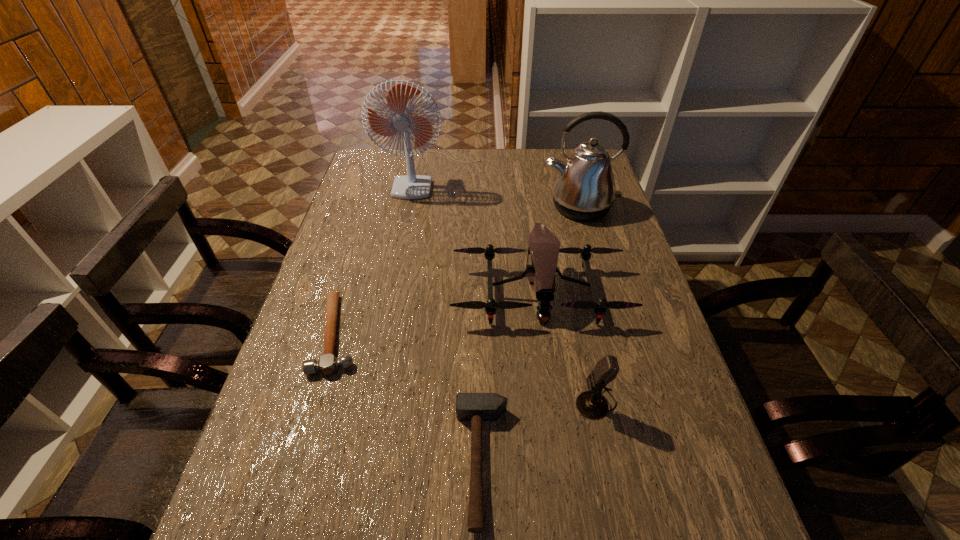
This screenshot has height=540, width=960. Identify the location of fan. (401, 119).

Where is `the second tallest object`? The height and width of the screenshot is (540, 960). the second tallest object is located at coordinates (584, 189).

You are a GUI agent. You are given a task and a screenshot of the screen. Output one action in this format:
    pyautogui.click(x=<x>, y=<y>)
    Task: Click on the drone
    
    Given the screenshot: What is the action you would take?
    pyautogui.click(x=544, y=247)

The height and width of the screenshot is (540, 960). What are the coordinates of `microphone` in the screenshot? It's located at (591, 404).

You are a GUI agent. You are given a task and a screenshot of the screen. Output one action in this format:
    pyautogui.click(x=<x>, y=<y>)
    Task: Click on the nearer hammer
    The height and width of the screenshot is (540, 960).
    Given the screenshot: What is the action you would take?
    pyautogui.click(x=476, y=407)

You are a GUI agent. You are given a task and a screenshot of the screen. Output one action in this format:
    pyautogui.click(x=<x>, y=<y>)
    Task: Click on the taller hammer
    This screenshot has width=960, height=540.
    Given the screenshot: What is the action you would take?
    pyautogui.click(x=476, y=407)

Locate an element on the screen. This screenshot has width=960, height=540. the farther hammer is located at coordinates (327, 364).

The height and width of the screenshot is (540, 960). Find the location of `the shortest object`. the shortest object is located at coordinates (327, 364).

Identify the location of free location located on the front-facing side of the fan. (426, 211).

Locate an element on the screen. The width and height of the screenshot is (960, 540). free space located 0.150m on the left of the fifth shortest object is located at coordinates (495, 207).